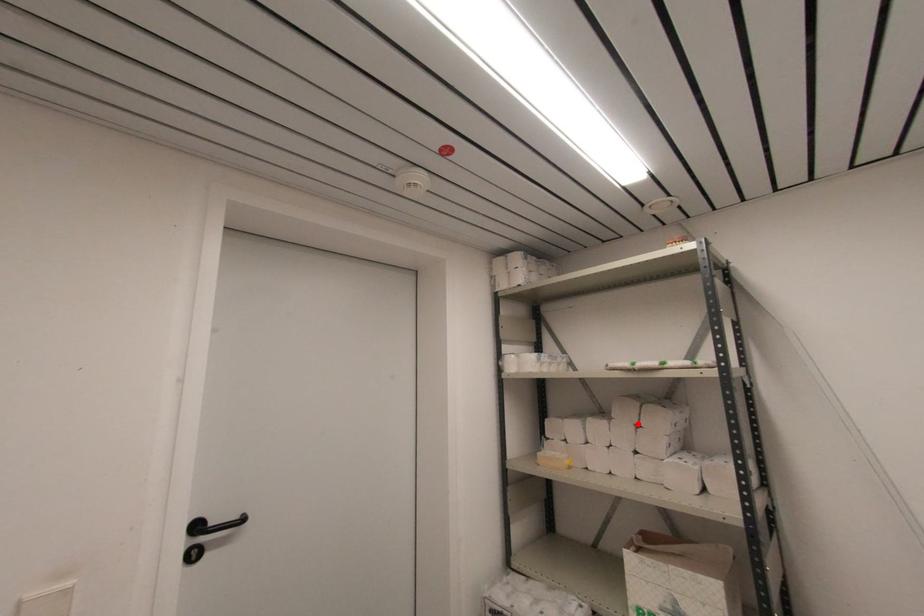
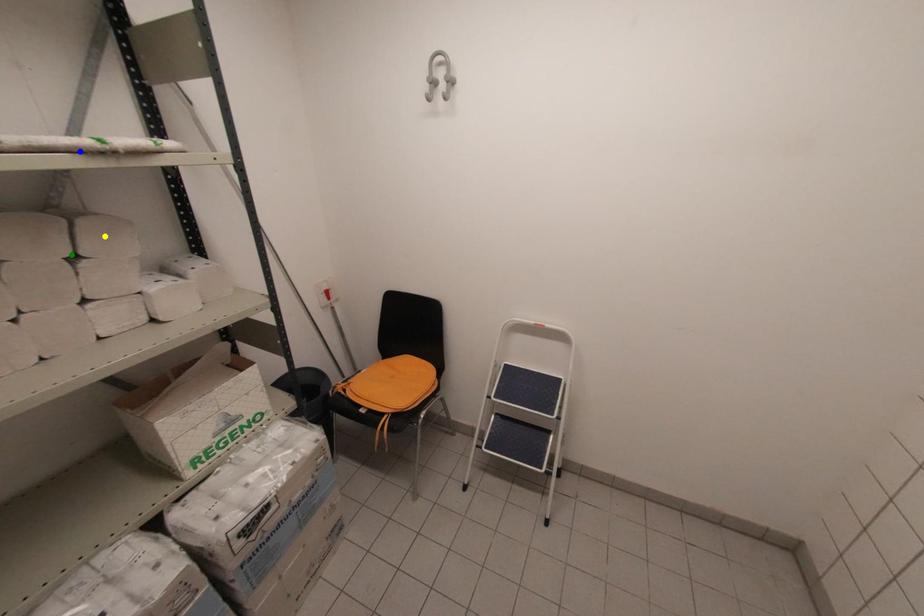
Question: I am providing you with two images of the same scene from different viewpoints. A red point is marked on the first image. You are given multiple points on the second image. Which point in image 2 is actually the same real-world point as the red point in image 1?

Choices:
 (A) green point
 (B) blue point
 (C) yellow point

Answer: (A)